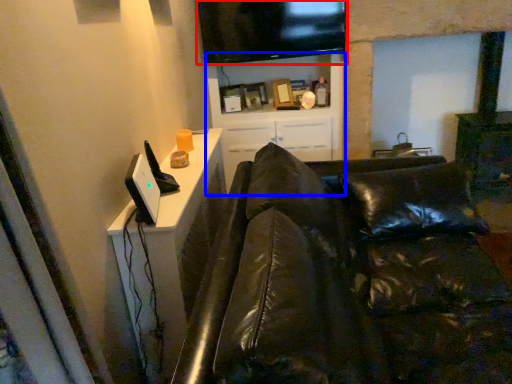
Question: Which object appears closest to the camera in this image, television (highlighted by a red box) or entertainment center (highlighted by a blue box)?

Choices:
 (A) television
 (B) entertainment center

Answer: (A)